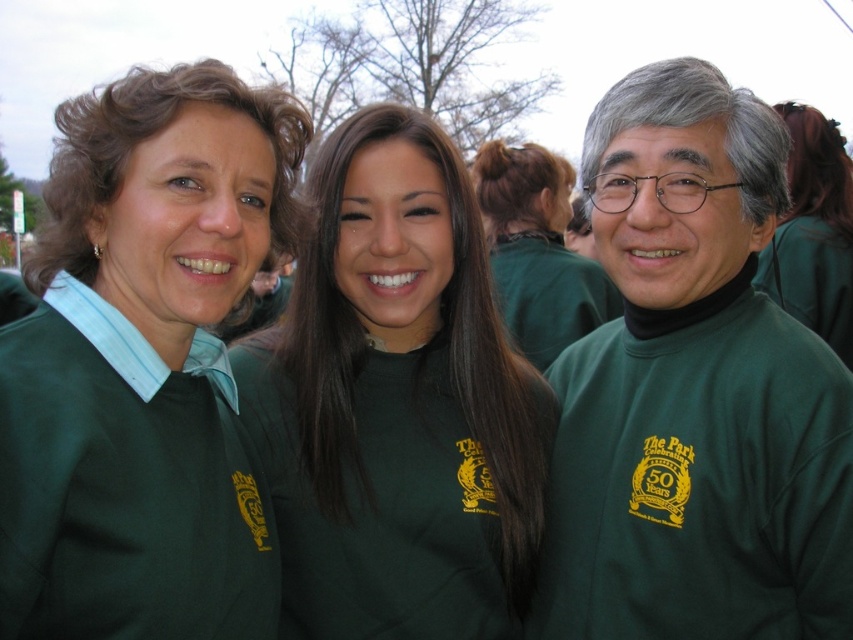
In the scene shown: You are taking a photo of the group and want to focus on the green turtleneck sweater at right and the green matte shirt at center. Which one is nearer to you?

The green turtleneck sweater at right is closer to the viewer than the green matte shirt at center.

Consider the image. You are organizing a charity event and need to ensure that all participants have shirts of the same size. You notice two participants wearing green turtleneck sweater at right and green matte shirt at center. Which one should you ask to exchange their shirt to match the other?

The green turtleneck sweater at right has a smaller size compared to green matte shirt at center, so you should ask the person wearing the green turtleneck sweater at right to exchange it for a larger size to match the green matte shirt at center.

You are organizing a group photo and need to ensure that all participants are visible. The group includes the green matte sweatshirt at center and the green matte shirt at center. Which clothing item should be moved to the back to make sure both are fully visible?

The green matte sweatshirt at center is in front of the green matte shirt at center. To ensure both are fully visible, move the green matte sweatshirt at center to the back so the green matte shirt at center can be seen.